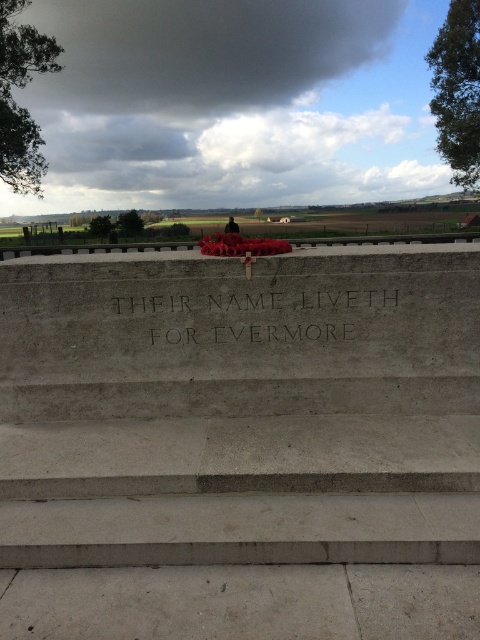
Between gray concrete stairs at center and black stone engraving at center, which one appears on the right side from the viewer's perspective?

Positioned to the right is gray concrete stairs at center.

Who is more forward, (201,582) or (289,320)?

Point (201,582) is in front.

Where is `gray concrete stairs at center`? gray concrete stairs at center is located at coordinates (240, 444).